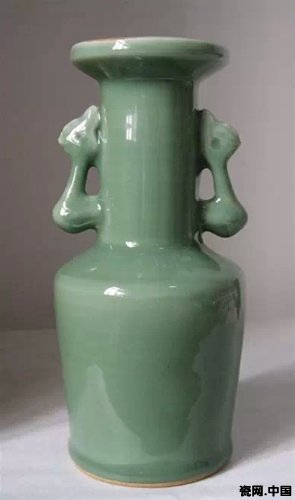
Find the location of a particular element. The height and width of the screenshot is (500, 295). side of vase bottom is located at coordinates (140, 484).